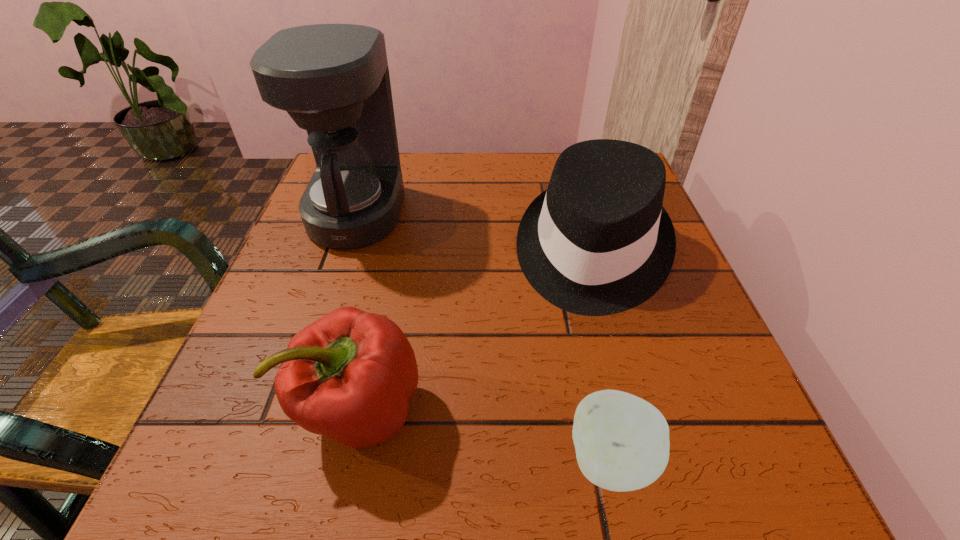
The height and width of the screenshot is (540, 960). I want to click on empty location between the shortest object and the coffee maker, so click(485, 337).

Where is `object that is the closest one to the bell pepper`? object that is the closest one to the bell pepper is located at coordinates (598, 241).

Identify the location of object that ranks as the second closest to the tallest object. (349, 376).

In order to click on blank area in the image that satisfies the following two spatial constraints: 1. on the button side of the coffee maker; 2. on the back side of the bell pepper in this screenshot , I will do `click(292, 409)`.

The image size is (960, 540). What are the coordinates of `free region that satisfies the following two spatial constraints: 1. on the back side of the fedora; 2. on the right side of the bell pepper` in the screenshot? It's located at (396, 251).

Where is `vacant space that satisfies the following two spatial constraints: 1. on the button side of the bell pepper; 2. on the left side of the tallest object`? The height and width of the screenshot is (540, 960). vacant space that satisfies the following two spatial constraints: 1. on the button side of the bell pepper; 2. on the left side of the tallest object is located at coordinates (292, 409).

Find the location of `vacant space that satisfies the following two spatial constraints: 1. on the button side of the tallest object; 2. on the left side of the apple`. vacant space that satisfies the following two spatial constraints: 1. on the button side of the tallest object; 2. on the left side of the apple is located at coordinates (275, 461).

This screenshot has width=960, height=540. I want to click on vacant space that satisfies the following two spatial constraints: 1. on the back side of the shortest object; 2. on the button side of the tallest object, so click(558, 213).

The height and width of the screenshot is (540, 960). In order to click on free spot that satisfies the following two spatial constraints: 1. on the back side of the fedora; 2. on the right side of the apple in this screenshot , I will do `click(566, 251)`.

Image resolution: width=960 pixels, height=540 pixels. Identify the location of free spot that satisfies the following two spatial constraints: 1. on the front side of the bell pepper; 2. on the left side of the apple. (350, 461).